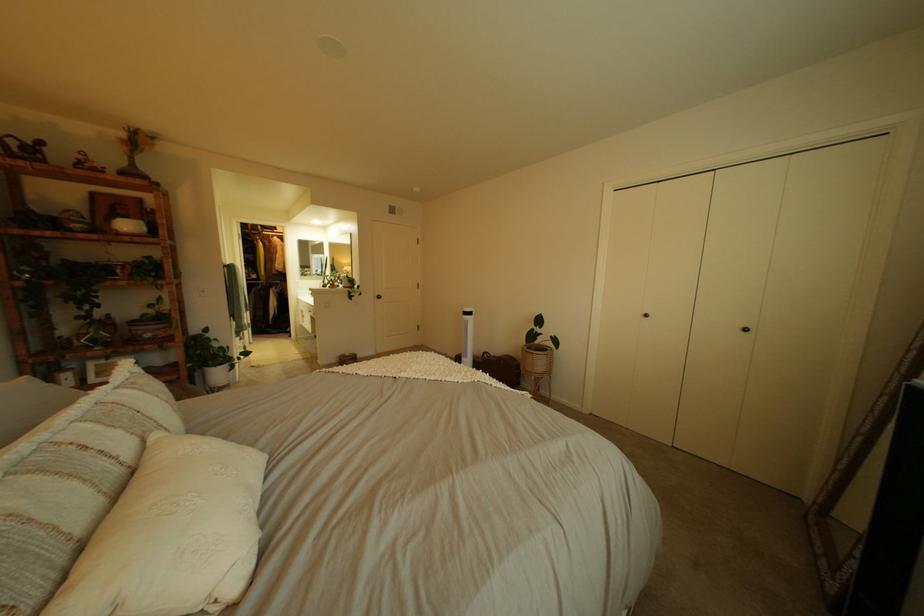
Where is `striped decorative pillow`? striped decorative pillow is located at coordinates (71, 480).